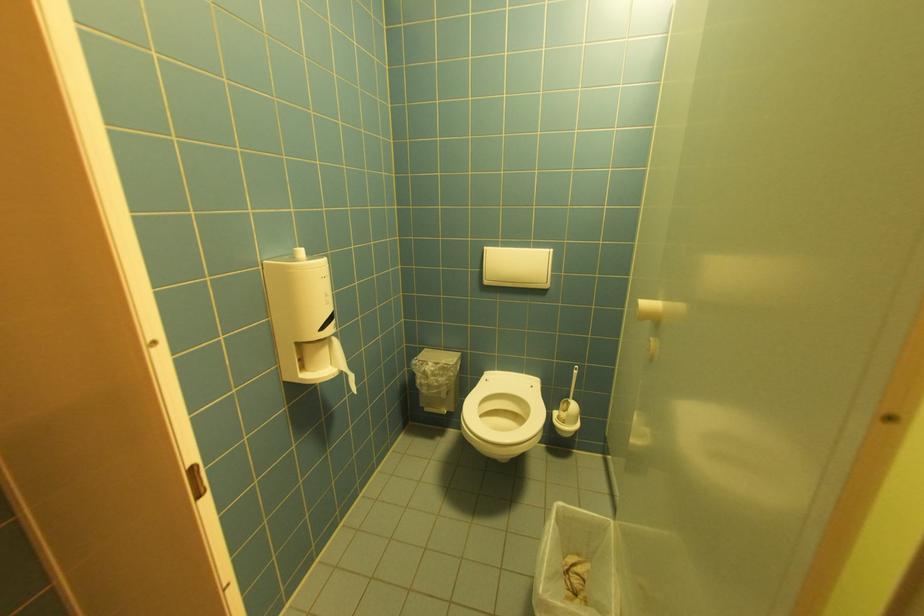
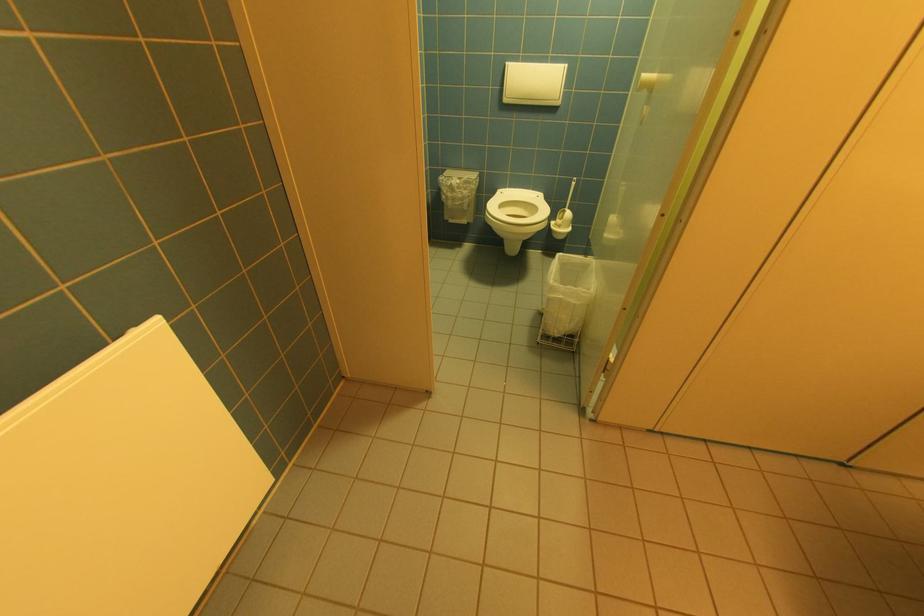
The point at (492,283) is marked in the first image. Where is the corresponding point in the second image?

(512, 100)